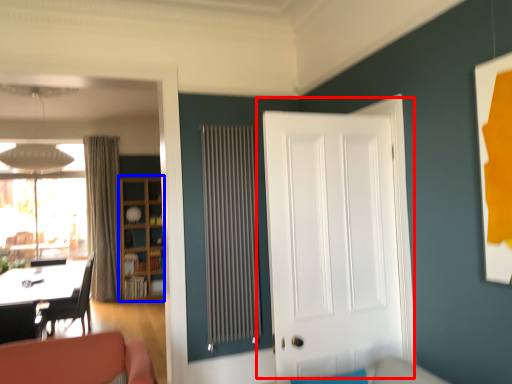
Question: Which of the following is the farthest to the observer, door (highlighted by a red box) or bookshelf (highlighted by a blue box)?

Choices:
 (A) door
 (B) bookshelf

Answer: (B)